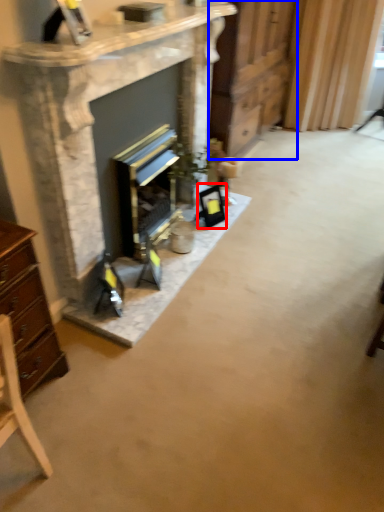
Question: Among these objects, which one is farthest to the camera, picture frame (highlighted by a red box) or dresser (highlighted by a blue box)?

Choices:
 (A) picture frame
 (B) dresser

Answer: (A)